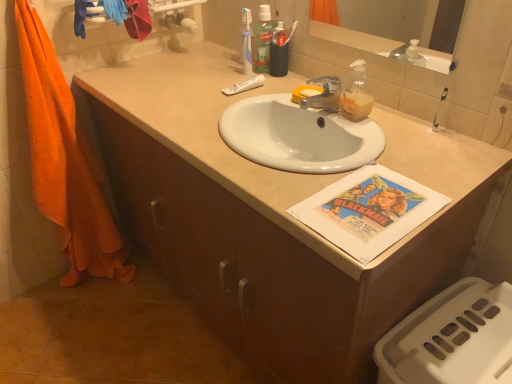
Identify the location of orange cotton towel at left. (65, 161).

Measure the distance between point (272, 27) and camera.

The distance of point (272, 27) from camera is 4.95 feet.

This screenshot has height=384, width=512. I want to click on white matte tube at center, so click(x=244, y=85).

Identify the location of orange cotton towel at left. This screenshot has width=512, height=384. (65, 161).

Could you tell me if orange cotton towel at left is turned towards green plastic mouthwash at upper center?

No, orange cotton towel at left is not aimed at green plastic mouthwash at upper center.

Is there a large distance between orange cotton towel at left and green plastic mouthwash at upper center?

No, orange cotton towel at left is in close proximity to green plastic mouthwash at upper center.

Between green plastic mouthwash at upper center and silver metallic faucet at center, which one has less height?

With less height is silver metallic faucet at center.

The height and width of the screenshot is (384, 512). In order to click on faucet in front of the green plastic mouthwash at upper center in this screenshot , I will do `click(324, 95)`.

Can you confirm if green plastic mouthwash at upper center is bigger than silver metallic faucet at center?

Yes.

Would you say orange cotton towel at left is part of white matte tube at center's contents?

No, orange cotton towel at left is not a part of white matte tube at center.

Is white matte tube at center not near orange cotton towel at left?

No, white matte tube at center is in close proximity to orange cotton towel at left.

Is white matte tube at center turned away from orange cotton towel at left?

white matte tube at center is not turned away from orange cotton towel at left.

Who is shorter, white matte tube at center or silver metallic faucet at center?

Standing shorter between the two is white matte tube at center.

How much distance is there between white matte tube at center and silver metallic faucet at center?

The distance of white matte tube at center from silver metallic faucet at center is 9.93 inches.

Is white matte tube at center oriented away from silver metallic faucet at center?

No, white matte tube at center is not facing away from silver metallic faucet at center.

Considering the positions of objects white matte tube at center and silver metallic faucet at center in the image provided, who is in front, white matte tube at center or silver metallic faucet at center?

silver metallic faucet at center is closer to the camera.

Where is `toothpaste that appears behind the orange cotton towel at left`? The image size is (512, 384). toothpaste that appears behind the orange cotton towel at left is located at coordinates (244, 85).

From the image's perspective, is orange cotton towel at left below white matte tube at center?

Yes, from the image's perspective, orange cotton towel at left is below white matte tube at center.

Does orange cotton towel at left have a greater height compared to white matte tube at center?

Yes.

Based on the photo, is orange cotton towel at left oriented towards white matte tube at center?

No, orange cotton towel at left is not oriented towards white matte tube at center.

From a real-world perspective, relative to orange cotton towel at left, is green plastic mouthwash at upper center vertically above or below?

green plastic mouthwash at upper center is situated higher than orange cotton towel at left in the real world.

Which object is wider, green plastic mouthwash at upper center or orange cotton towel at left?

Wider between the two is orange cotton towel at left.

Does point (267, 49) lie in front of point (40, 92)?

No, it is behind (40, 92).

Looking at this image, from the image's perspective, who appears lower, green plastic mouthwash at upper center or orange cotton towel at left?

orange cotton towel at left, from the image's perspective.

From a real-world perspective, is silver metallic faucet at center positioned over green plastic mouthwash at upper center based on gravity?

No.

In the scene shown: Is silver metallic faucet at center shorter than green plastic mouthwash at upper center?

Correct, silver metallic faucet at center is not as tall as green plastic mouthwash at upper center.

Based on their sizes in the image, would you say silver metallic faucet at center is bigger or smaller than green plastic mouthwash at upper center?

silver metallic faucet at center is smaller than green plastic mouthwash at upper center.

This screenshot has width=512, height=384. Identify the location of mouthwash lying on the right of orange cotton towel at left. (262, 40).

Image resolution: width=512 pixels, height=384 pixels. In order to click on mouthwash on the left side of silver metallic faucet at center in this screenshot , I will do `click(262, 40)`.

Consider the image. When comparing their distances from green plastic mouthwash at upper center, does white matte tube at center or orange cotton towel at left seem further?

orange cotton towel at left lies further to green plastic mouthwash at upper center than the other object.

Which object lies nearer to the anchor point silver metallic faucet at center, orange cotton towel at left or white matte tube at center?

The object closer to silver metallic faucet at center is white matte tube at center.

Based on their spatial positions, is white matte tube at center or orange cotton towel at left closer to silver metallic faucet at center?

white matte tube at center.

Estimate the real-world distances between objects in this image. Which object is closer to orange cotton towel at left, silver metallic faucet at center or white matte tube at center?

white matte tube at center is positioned closer to the anchor orange cotton towel at left.

Based on their spatial positions, is silver metallic faucet at center or green plastic mouthwash at upper center closer to orange cotton towel at left?

green plastic mouthwash at upper center lies closer to orange cotton towel at left than the other object.

Which object lies further to the anchor point orange cotton towel at left, green plastic mouthwash at upper center or silver metallic faucet at center?

The object further to orange cotton towel at left is silver metallic faucet at center.

Which object lies further to the anchor point green plastic mouthwash at upper center, white matte tube at center or silver metallic faucet at center?

silver metallic faucet at center is further to green plastic mouthwash at upper center.

Which object lies further to the anchor point white matte tube at center, silver metallic faucet at center or green plastic mouthwash at upper center?

silver metallic faucet at center is further to white matte tube at center.

This screenshot has width=512, height=384. I want to click on toothpaste located between orange cotton towel at left and green plastic mouthwash at upper center in the left-right direction, so click(244, 85).

You are a GUI agent. You are given a task and a screenshot of the screen. Output one action in this format:
    pyautogui.click(x=<x>, y=<y>)
    Task: Click on the mouthwash between orange cotton towel at left and silver metallic faucet at center
    This screenshot has height=384, width=512.
    Given the screenshot: What is the action you would take?
    pyautogui.click(x=262, y=40)

Locate an element on the screen. toothpaste between orange cotton towel at left and silver metallic faucet at center from left to right is located at coordinates (244, 85).

Where is `toothpaste that lies between green plastic mouthwash at upper center and silver metallic faucet at center from top to bottom`? The width and height of the screenshot is (512, 384). toothpaste that lies between green plastic mouthwash at upper center and silver metallic faucet at center from top to bottom is located at coordinates (244, 85).